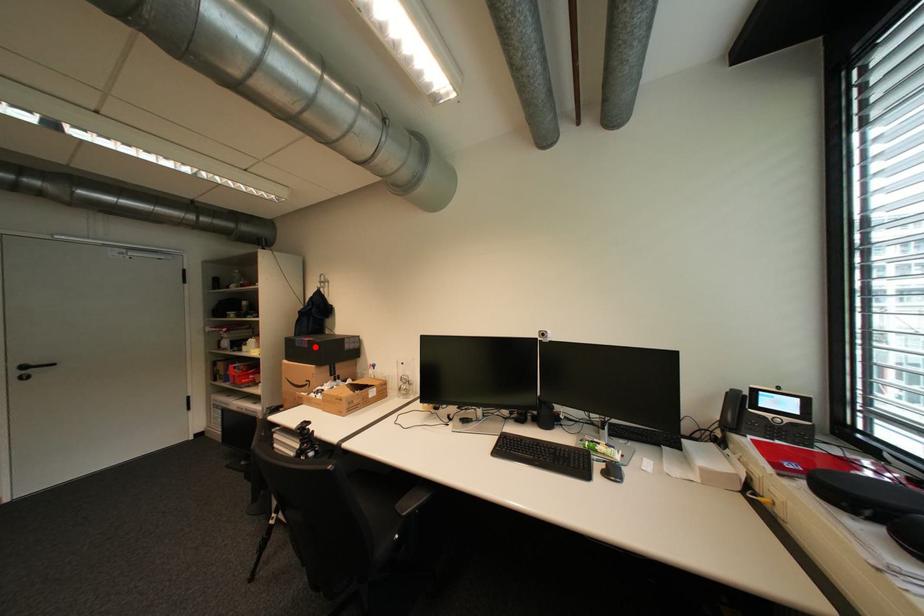
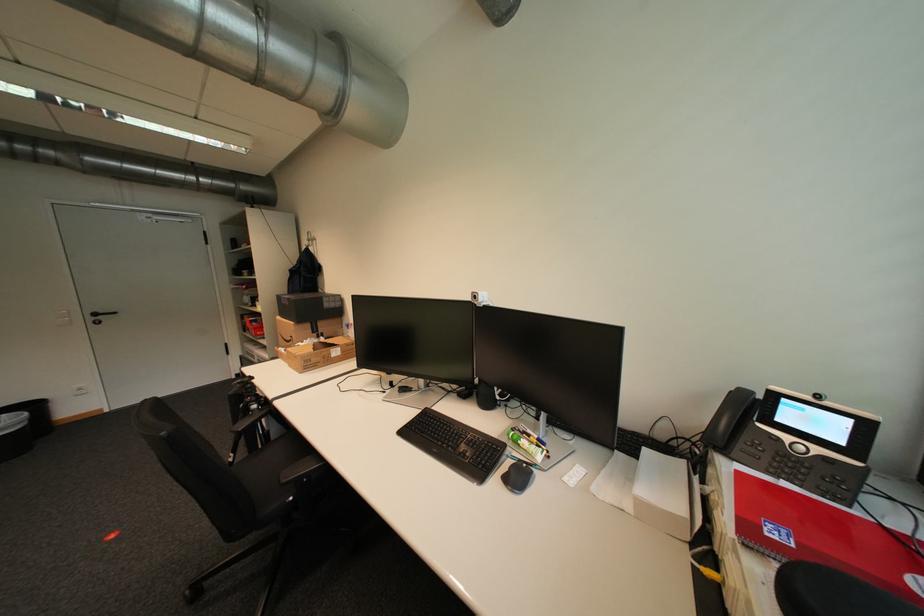
Find the pixel in the second image that matches the highlighted location in the first image.

(296, 305)